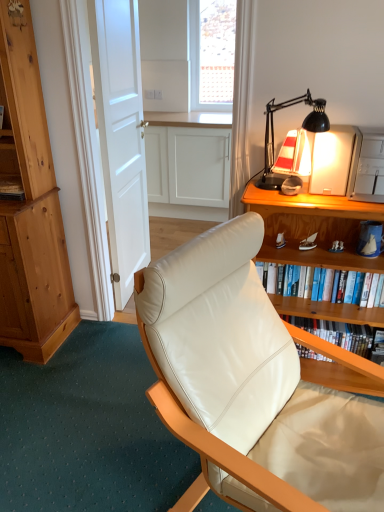
I want to click on white leather chair at center, so click(x=249, y=385).

You are a GUI agent. You are given a task and a screenshot of the screen. Output one action in this format:
    pyautogui.click(x=<x>, y=<y>)
    Task: Click on the hardcover book at center, arranged as the first book when ordered from the bottom
    The width and height of the screenshot is (384, 512).
    Given the screenshot: What is the action you would take?
    pyautogui.click(x=338, y=333)

Measure the distance between white mesh screen at upper center and camera.

3.97 meters.

Locate an element on the screen. white matte door at center is located at coordinates (121, 135).

What is the approximate height of black matte desk lamp at upper right?

The height of black matte desk lamp at upper right is 39.91 centimeters.

Find the location of a particular element. wooden desk at right is located at coordinates (312, 227).

From the image's perspective, is black matte desk lamp at upper right above hardcover book at center, arranged as the first book when ordered from the bottom?

Yes, from the image's perspective, black matte desk lamp at upper right is over hardcover book at center, arranged as the first book when ordered from the bottom.

Does black matte desk lamp at upper right contain hardcover book at center, arranged as the first book when ordered from the bottom?

No, hardcover book at center, arranged as the first book when ordered from the bottom, is not inside black matte desk lamp at upper right.

Is black matte desk lamp at upper right turned away from hardcover book at center, positioned as the second book in top-to-bottom order?

black matte desk lamp at upper right does not have its back to hardcover book at center, positioned as the second book in top-to-bottom order.

Looking at their sizes, would you say black matte desk lamp at upper right is wider or thinner than hardcover book at center, positioned as the second book in top-to-bottom order?

black matte desk lamp at upper right is wider than hardcover book at center, positioned as the second book in top-to-bottom order.

This screenshot has width=384, height=512. I want to click on lamp in front of the white mesh screen at upper center, so click(302, 127).

Based on the photo, in terms of width, does white mesh screen at upper center look wider or thinner when compared to black matte desk lamp at upper right?

In the image, white mesh screen at upper center appears to be more narrow than black matte desk lamp at upper right.

Is white mesh screen at upper center touching black matte desk lamp at upper right?

No, white mesh screen at upper center is not making contact with black matte desk lamp at upper right.

Is point (362, 330) positioned after point (274, 234)?

No, (362, 330) is in front of (274, 234).

Is hardcover book at center, arranged as the first book when ordered from the bottom, oriented away from wooden desk at right?

Absolutely, hardcover book at center, arranged as the first book when ordered from the bottom, is directed away from wooden desk at right.

Is hardcover book at center, arranged as the first book when ordered from the bottom, positioned in front of wooden desk at right?

No, it is behind wooden desk at right.

Locate an element on the screen. This screenshot has height=512, width=384. chair on the left of the wooden desk at right is located at coordinates (249, 385).

Is wooden desk at right spatially inside white leather chair at center, or outside of it?

wooden desk at right cannot be found inside white leather chair at center.

Between point (383, 260) and point (292, 502), which one is positioned behind?

The point (383, 260) is more distant.

Between wooden desk at right and white leather chair at center, which one has larger width?

Wider between the two is white leather chair at center.

Considering their positions, is wooden desk at right located in front of or behind hardcover book at right, the 1th book positioned from the top?

wooden desk at right is in front of hardcover book at right, the 1th book positioned from the top.

Is wooden desk at right not inside hardcover book at right, the 1th book positioned from the top?

Absolutely, wooden desk at right is external to hardcover book at right, the 1th book positioned from the top.

Considering the sizes of objects wooden desk at right and hardcover book at right, the 1th book positioned from the top, in the image provided, who is smaller, wooden desk at right or hardcover book at right, the 1th book positioned from the top,?

Smaller between the two is hardcover book at right, the 1th book positioned from the top.

What's the angular difference between wooden desk at right and hardcover book at right, the 1th book positioned from the top,'s facing directions?

0.447 degrees.

Considering the sizes of white leather chair at center and wooden desk at right in the image, is white leather chair at center taller or shorter than wooden desk at right?

white leather chair at center is taller than wooden desk at right.

Is white leather chair at center next to wooden desk at right?

No, white leather chair at center is not next to wooden desk at right.

Is white leather chair at center oriented away from wooden desk at right?

No, white leather chair at center is not facing the opposite direction of wooden desk at right.

How many degrees apart are the facing directions of white leather chair at center and wooden desk at right?

The angle between the facing direction of white leather chair at center and the facing direction of wooden desk at right is 65.4 degrees.

Is the depth of black matte desk lamp at upper right less than that of white leather chair at center?

No, black matte desk lamp at upper right is behind white leather chair at center.

Considering the positions of point (273, 112) and point (211, 257), is point (273, 112) closer or farther from the camera than point (211, 257)?

Point (273, 112) appears to be farther away from the viewer than point (211, 257).

Find the location of `chair that is on the left side of black matte desk lamp at upper right`. chair that is on the left side of black matte desk lamp at upper right is located at coordinates (249, 385).

Is black matte desk lamp at upper right with white leather chair at center?

No, black matte desk lamp at upper right is not making contact with white leather chair at center.

Where is `lamp in front of the hardcover book at center, arranged as the first book when ordered from the bottom`? Image resolution: width=384 pixels, height=512 pixels. lamp in front of the hardcover book at center, arranged as the first book when ordered from the bottom is located at coordinates (302, 127).

Identify the location of lamp below the white mesh screen at upper center (from the image's perspective). (302, 127).

Estimate the real-world distances between objects in this image. Which object is further from white leather chair at center, white matte door at center or black matte desk lamp at upper right?

white matte door at center is positioned further to the anchor white leather chair at center.

In the scene shown: Looking at the image, which one is located closer to wooden desk at right, white leather chair at center or black matte desk lamp at upper right?

The object closer to wooden desk at right is black matte desk lamp at upper right.

When comparing their distances from white mesh screen at upper center, does white leather chair at center or white matte door at center seem further?

white leather chair at center lies further to white mesh screen at upper center than the other object.

From the image, which object appears to be nearer to white mesh screen at upper center, hardcover book at right, the 1th book positioned from the top, or black matte desk lamp at upper right?

Among the two, black matte desk lamp at upper right is located nearer to white mesh screen at upper center.

Looking at this image, from the image, which object appears to be farther from white leather chair at center, hardcover book at right, which is the second book from bottom to top, or white mesh screen at upper center?

white mesh screen at upper center lies further to white leather chair at center than the other object.

Considering their positions, is white leather chair at center positioned closer to white matte door at center than wooden desk at right?

The object closer to white matte door at center is wooden desk at right.

Based on their spatial positions, is black matte desk lamp at upper right or white matte door at center closer to hardcover book at right, which is the second book from bottom to top?

black matte desk lamp at upper right lies closer to hardcover book at right, which is the second book from bottom to top, than the other object.

Looking at the image, which one is located closer to white mesh screen at upper center, white matte door at center or white leather chair at center?

white matte door at center lies closer to white mesh screen at upper center than the other object.

Locate an element on the screen. This screenshot has width=384, height=512. book between white leather chair at center and hardcover book at center, positioned as the second book in top-to-bottom order, from front to back is located at coordinates (327, 285).

Find the location of a particular element. door located between wooden desk at right and white mesh screen at upper center in the depth direction is located at coordinates (121, 135).

At what (x,y) coordinates should I click in order to perform the action: click on desk between white leather chair at center and hardcover book at center, positioned as the second book in top-to-bottom order, along the z-axis. Please return your answer as a coordinate pair (x, y). This screenshot has width=384, height=512. Looking at the image, I should click on (312, 227).

At what (x,y) coordinates should I click in order to perform the action: click on desk situated between white matte door at center and hardcover book at right, which is the second book from bottom to top, from left to right. Please return your answer as a coordinate pair (x, y). Image resolution: width=384 pixels, height=512 pixels. Looking at the image, I should click on (312, 227).